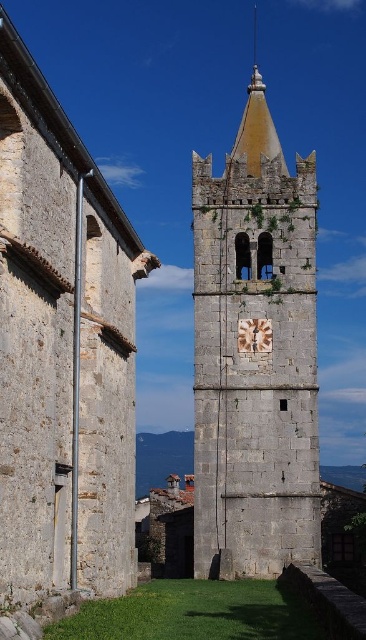
Question: Does gray stone bell tower at center appear under rustic stone clock at center?

Choices:
 (A) no
 (B) yes

Answer: (A)

Question: Which of the following is the farthest from the observer?

Choices:
 (A) gray stone bell tower at center
 (B) gray stone church tower at center

Answer: (A)

Question: Among these points, which one is nearest to the camera?

Choices:
 (A) (39, 576)
 (B) (245, 323)
 (C) (282, 464)

Answer: (A)

Question: Can you confirm if gray stone church tower at center is positioned to the right of rustic stone clock at center?

Choices:
 (A) yes
 (B) no

Answer: (B)

Question: Which object is closer to the camera taking this photo?

Choices:
 (A) rustic stone clock at center
 (B) gray stone church tower at center

Answer: (B)

Question: Is gray stone church tower at center positioned at the back of rustic stone clock at center?

Choices:
 (A) no
 (B) yes

Answer: (A)